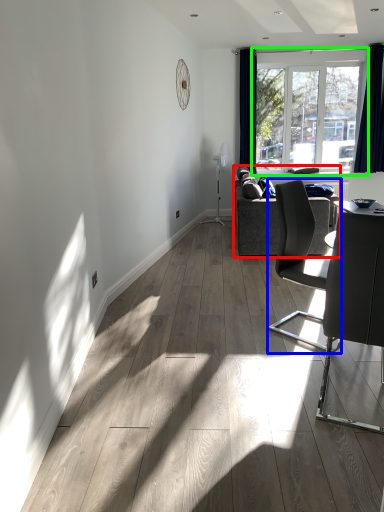
Question: Estimate the real-world distances between objects in this image. Which object is closer to studio couch (highlighted by a red box), chair (highlighted by a blue box) or window (highlighted by a green box)?

Choices:
 (A) chair
 (B) window

Answer: (A)